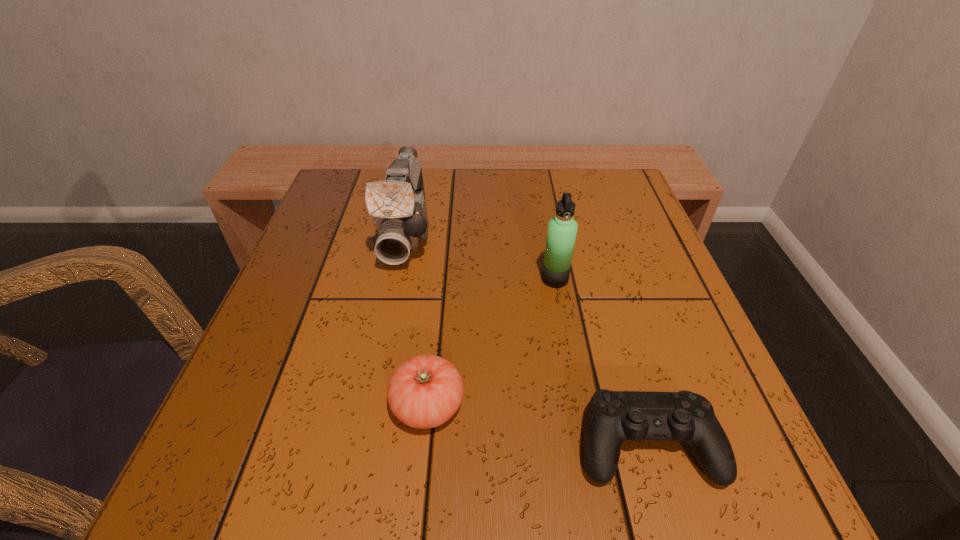
At what (x,y) coordinates should I click in order to perform the action: click on object that is the closest to the thermos bottle. Please return your answer as a coordinate pair (x, y). Looking at the image, I should click on (397, 204).

Identify which object is the second closest to the camcorder. Please provide its 2D coordinates. Your answer should be formatted as a tuple, i.e. [(x, y)], where the tuple contains the x and y coordinates of a point satisfying the conditions above.

[(425, 391)]

The width and height of the screenshot is (960, 540). What are the coordinates of `free space that satisfies the following two spatial constraints: 1. on the front-facing side of the camcorder; 2. on the left side of the tomato` in the screenshot? It's located at (372, 405).

Locate an element on the screen. free space that satisfies the following two spatial constraints: 1. on the front-facing side of the camcorder; 2. on the left side of the control is located at coordinates (x=364, y=445).

You are a GUI agent. You are given a task and a screenshot of the screen. Output one action in this format:
    pyautogui.click(x=<x>, y=<y>)
    Task: Click on the free space that satisfies the following two spatial constraints: 1. on the front-facing side of the camcorder; 2. on the left side of the thermos bottle
    This screenshot has height=540, width=960.
    Given the screenshot: What is the action you would take?
    pyautogui.click(x=397, y=279)

This screenshot has height=540, width=960. Find the location of `free space that satisfies the following two spatial constraints: 1. on the front-facing side of the control; 2. on the right side of the camcorder`. free space that satisfies the following two spatial constraints: 1. on the front-facing side of the control; 2. on the right side of the camcorder is located at coordinates (364, 445).

I want to click on vacant region that satisfies the following two spatial constraints: 1. on the front-facing side of the tomato; 2. on the right side of the camcorder, so click(372, 405).

The width and height of the screenshot is (960, 540). I want to click on vacant space that satisfies the following two spatial constraints: 1. on the front-facing side of the camcorder; 2. on the left side of the thermos bottle, so click(x=397, y=279).

The image size is (960, 540). In order to click on vacant space that satisfies the following two spatial constraints: 1. on the front-facing side of the camcorder; 2. on the left side of the thermos bottle in this screenshot , I will do point(397,279).

Locate an element on the screen. This screenshot has height=540, width=960. vacant space that satisfies the following two spatial constraints: 1. on the front-facing side of the tomato; 2. on the right side of the camcorder is located at coordinates (372, 405).